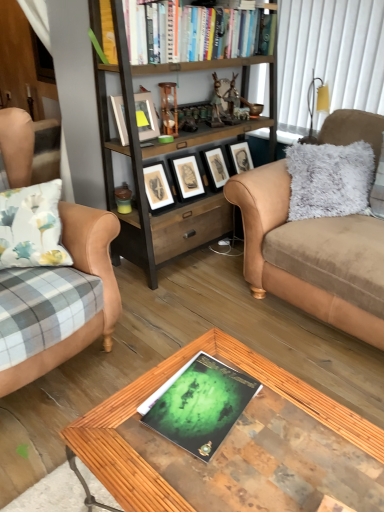
Question: Is point (153, 217) closer or farther from the camera than point (87, 333)?

Choices:
 (A) farther
 (B) closer

Answer: (A)

Question: Based on their sizes in the image, would you say woodenmaterial/texture bookcase at center is bigger or smaller than tan leather couch at left, which is counted as the 1th studio couch, starting from the left?

Choices:
 (A) small
 (B) big

Answer: (B)

Question: Considering the real-world distances, which object is farthest from the woodenmaterial/texture bookcase at center?

Choices:
 (A) tan leather couch at left, acting as the 2th studio couch starting from the right
 (B) green matte magazine at center
 (C) suede couch at right, which appears as the second studio couch when viewed from the left
 (D) wooden glass coffee table at center
 (E) matte wooden picture frame at upper center, arranged as the second picture frame when viewed from the back

Answer: (B)

Question: Which object is positioned closest to the matte wooden picture frame at upper center, arranged as the first picture frame when viewed from the front?

Choices:
 (A) suede couch at right, acting as the first studio couch starting from the right
 (B) matte black picture frame at center, which is counted as the first picture frame, starting from the back
 (C) hardcover books at upper center
 (D) green matte magazine at center
 (E) wooden glass coffee table at center

Answer: (B)